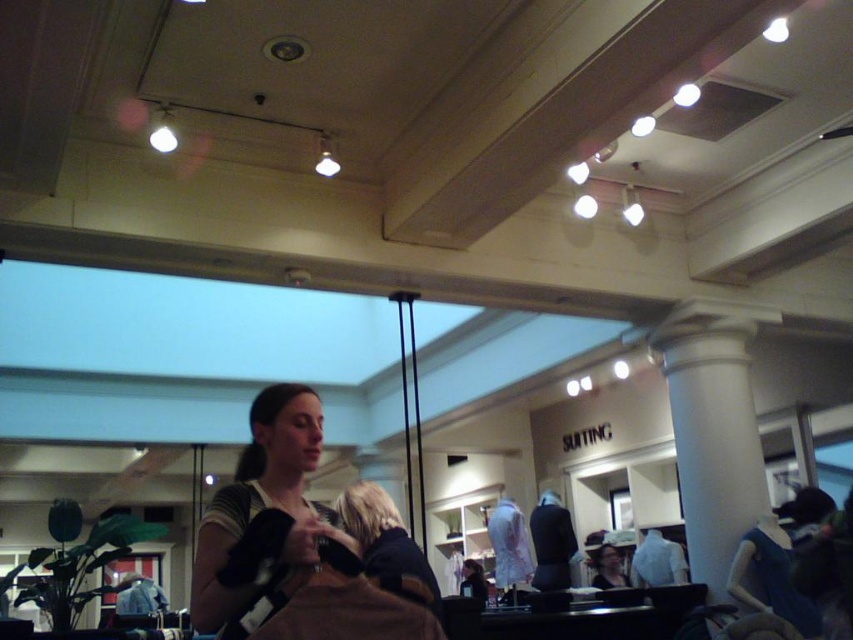
In the scene shown: Is white smooth column at center to the left of matte brown purse at center from the viewer's perspective?

In fact, white smooth column at center is to the right of matte brown purse at center.

Is white smooth column at center shorter than matte brown purse at center?

No.

I want to click on white smooth column at center, so click(x=712, y=429).

In the scene shown: Is white smooth column at center smaller than blonde hair at center?

Actually, white smooth column at center might be larger than blonde hair at center.

Which is behind, point (679, 428) or point (339, 504)?

Positioned behind is point (679, 428).

In order to click on white smooth column at center in this screenshot , I will do `click(712, 429)`.

Does matte brown purse at center have a lesser width compared to blonde hair at center?

No, matte brown purse at center is not thinner than blonde hair at center.

Is matte brown purse at center positioned in front of blonde hair at center?

Yes, it is.

Is point (193, 579) farther from camera compared to point (407, 572)?

No, (193, 579) is closer to viewer.

Find the location of `matte brown purse at center`. matte brown purse at center is located at coordinates (263, 500).